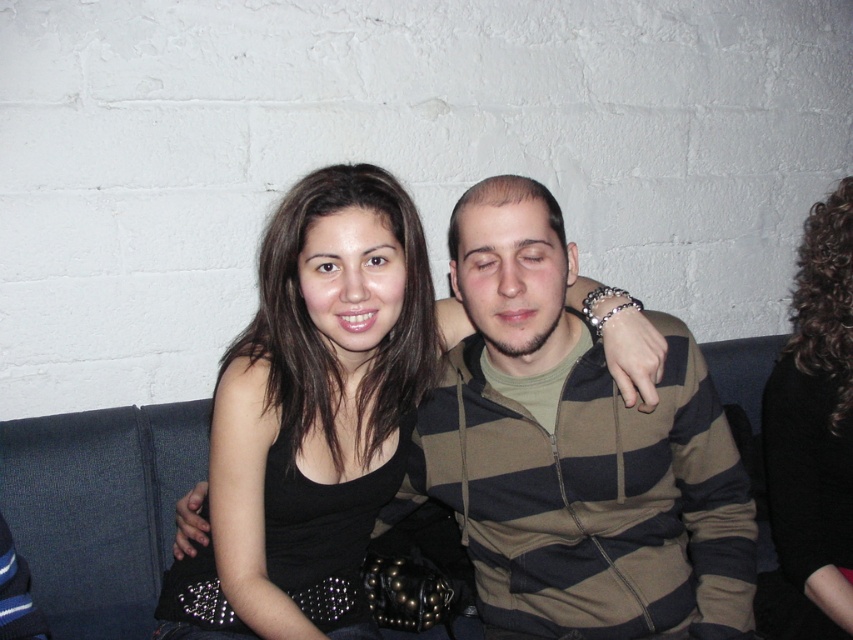
Can you confirm if striped hoodie at center is positioned to the right of black curly hair at upper right?

In fact, striped hoodie at center is to the left of black curly hair at upper right.

In the scene shown: Is striped hoodie at center wider than black curly hair at upper right?

Yes.

Where is `striped hoodie at center`? Image resolution: width=853 pixels, height=640 pixels. striped hoodie at center is located at coordinates (576, 451).

What are the coordinates of `striped hoodie at center` in the screenshot? It's located at (576, 451).

The image size is (853, 640). What do you see at coordinates (576, 451) in the screenshot?
I see `striped hoodie at center` at bounding box center [576, 451].

Between striped hoodie at center and black leather gloves at center, which one is positioned higher?

black leather gloves at center

Is point (514, 326) closer to viewer compared to point (213, 582)?

That is True.

Find the location of a particular element. striped hoodie at center is located at coordinates (576, 451).

Find the location of `black leather gloves at center`. black leather gloves at center is located at coordinates (311, 417).

Does point (265, 612) come in front of point (787, 408)?

That is True.

Where is `black leather gloves at center`? black leather gloves at center is located at coordinates (311, 417).